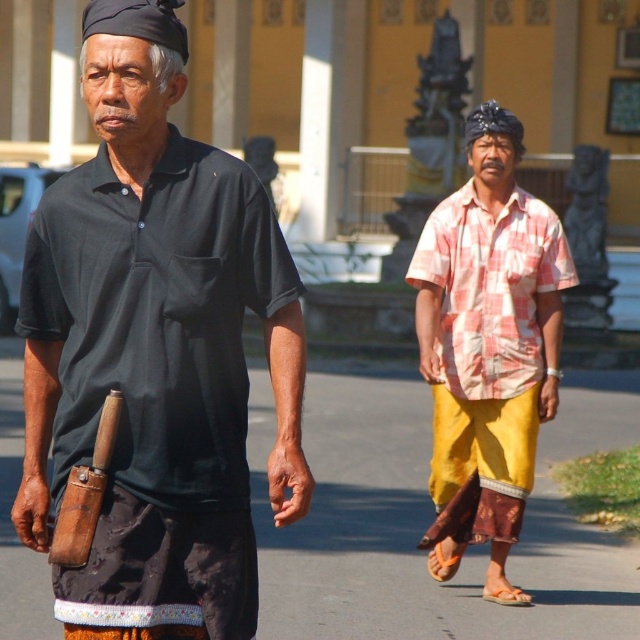
You are taking a photo of two people walking on a pathway. The first person is at point (104, 624) and the second is at point (492, 397). Which person will appear larger in your photo?

The person at point (104, 624) will appear larger in the photo because they are closer to the camera than the person at point (492, 397).

You are a photographer standing on the pathway wanting to take a photo of both the matte black shirt at center and the checkered fabric shirt at right. Since you want them both in the frame, which direction should you move to ensure both are visible?

You should move to the left side of the pathway because the matte black shirt at center is to the left of the checkered fabric shirt at right, so positioning yourself to the left will keep both in the frame.

Based on the coordinates provided, which object is located at point [154,355]?

The matte black shirt at center is located at point [154,355].